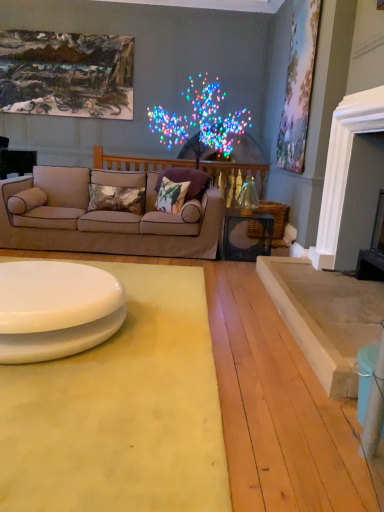
Question: Choose the correct answer: Is pastel floral canvas at upper right, the second picture frame when ordered from back to front, inside floral-patterned fabric pillow at center, which is the 3th pillow in left-to-right order, or outside it?

Choices:
 (A) outside
 (B) inside

Answer: (A)

Question: Would you say pastel floral canvas at upper right, placed as the 1th picture frame when sorted from front to back, is to the left or to the right of floral-patterned fabric pillow at center, which is the 2th pillow in right-to-left order, in the picture?

Choices:
 (A) left
 (B) right

Answer: (B)

Question: Estimate the real-world distances between objects in this image. Which object is farther from the satin beige pillow at left, marked as the 4th pillow in a right-to-left arrangement?

Choices:
 (A) floral-patterned fabric pillow at center, which is the 3th pillow in left-to-right order
 (B) fluffy fabric pillow at center, which ranks as the fourth pillow in left-to-right order
 (C) beige fabric couch at center
 (D) pastel floral canvas at upper right, which appears as the second picture frame when viewed from the left
 (E) white glossy table at lower left, arranged as the second table when viewed from the top

Answer: (D)

Question: Estimate the real-world distances between objects in this image. Which object is closer to the white glossy table at lower left, which is the second table from back to front?

Choices:
 (A) clear glass table at center, placed as the first table when sorted from right to left
 (B) fluffy fabric pillow at center, the 1th pillow from the right
 (C) textured floral pillow at center, the third pillow in the right-to-left sequence
 (D) yellow fabric mat at lower center
 (E) oil painting at upper left, which ranks as the 2th picture frame in front-to-back order

Answer: (D)